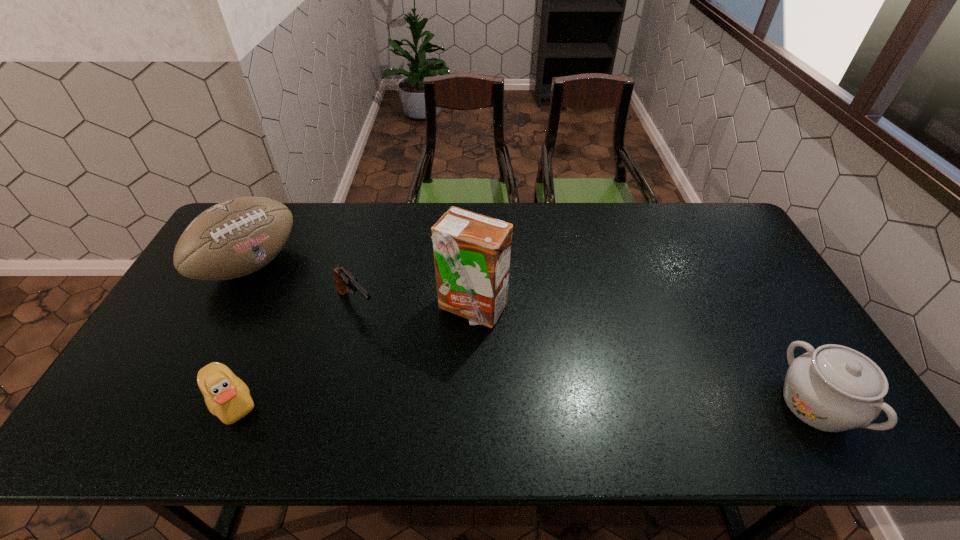
At what (x,y) coordinates should I click in order to perform the action: click on free space on the desktop that is between the duck and the rightmost object and is positioned along the barrel of the third object from left to right. Please return your answer as a coordinate pair (x, y). The height and width of the screenshot is (540, 960). Looking at the image, I should click on (446, 402).

Image resolution: width=960 pixels, height=540 pixels. In order to click on free spot on the desktop that is between the duck and the chinaware and is positioned on the straw side of the tallest object in this screenshot , I will do `click(505, 403)`.

Locate an element on the screen. free space on the desktop that is between the duck and the third shortest object and is positioned on the laces of the fourth shortest object is located at coordinates (448, 402).